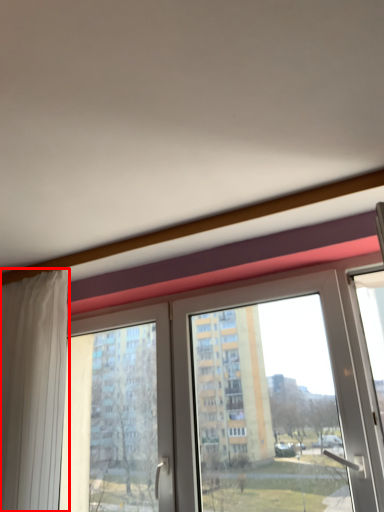
Question: Considering the relative positions of curtain (annotated by the red box) and window in the image provided, where is curtain (annotated by the red box) located with respect to the staircase?

Choices:
 (A) right
 (B) left

Answer: (B)